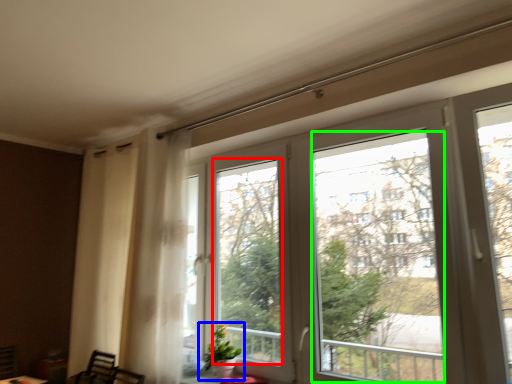
Question: Which is nearer to the window screen (highlighted by a red box)? houseplant (highlighted by a blue box) or window screen (highlighted by a green box).

Choices:
 (A) houseplant
 (B) window screen

Answer: (A)